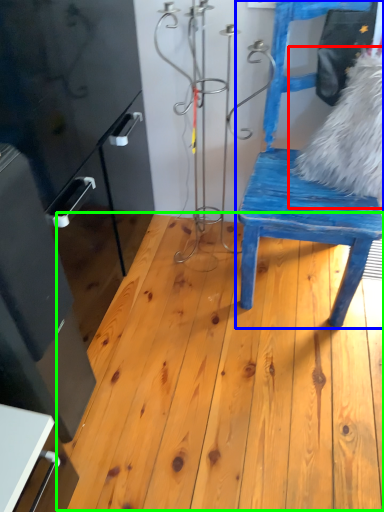
Question: Based on their relative distances, which object is farther from animal (highlighted by a red box)? Choose from chair (highlighted by a blue box) and hardwood (highlighted by a green box).

Choices:
 (A) chair
 (B) hardwood

Answer: (B)